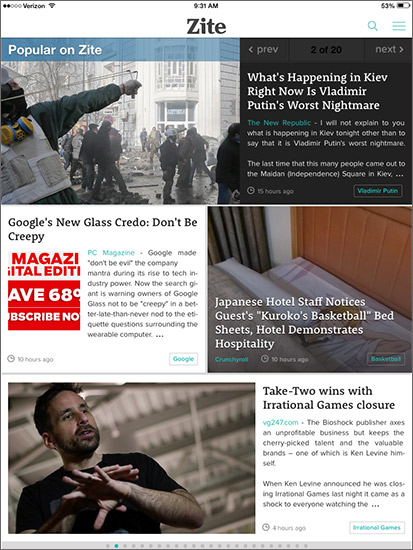
Where is `headboard`? headboard is located at coordinates (370, 253).